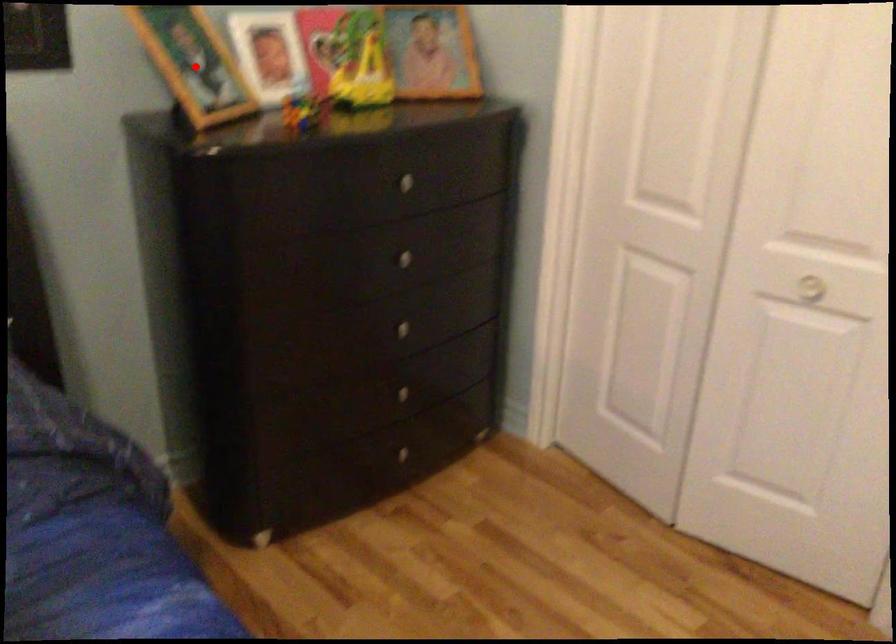
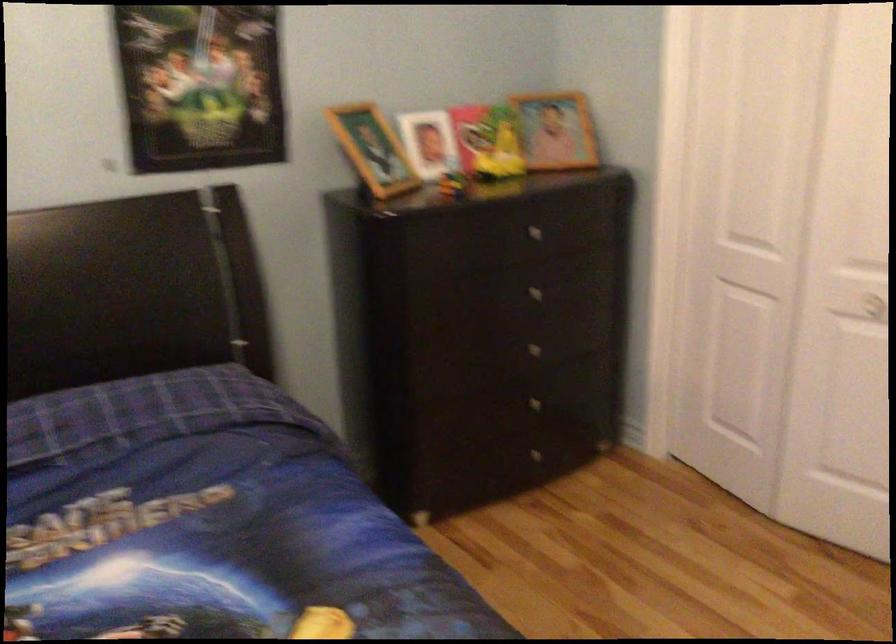
Question: I am providing you with two images of the same scene from different viewpoints. A red point is shown in image1. For the corresponding object point in image2, is it positioned nearer or farther from the camera?

Choices:
 (A) Nearer
 (B) Farther

Answer: (B)